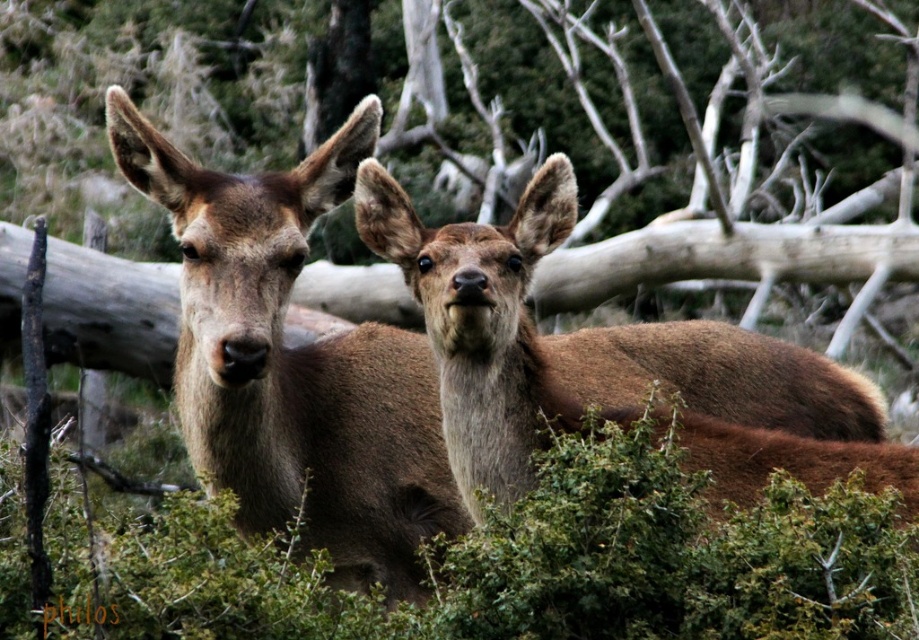
You are a GUI agent. You are given a task and a screenshot of the screen. Output one action in this format:
    pyautogui.click(x=<x>, y=<y>)
    Task: Click on the brown fur deer at center
    This screenshot has width=919, height=640.
    Given the screenshot: What is the action you would take?
    pyautogui.click(x=293, y=364)

Which is in front, point (239, 336) or point (634, 348)?

Point (239, 336) is more forward.

This screenshot has height=640, width=919. I want to click on brown fur deer at center, so click(293, 364).